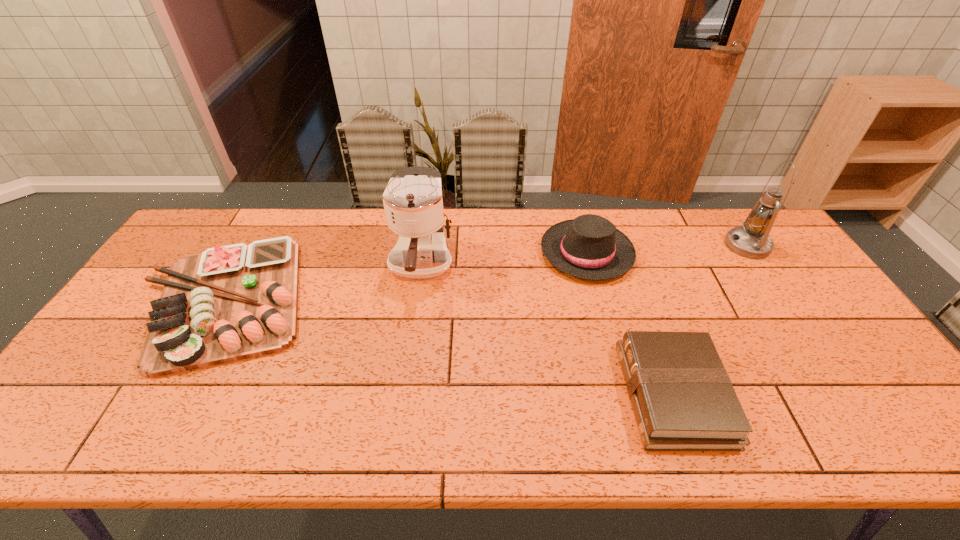
Image resolution: width=960 pixels, height=540 pixels. I want to click on object present at the far right corner, so click(751, 240).

The width and height of the screenshot is (960, 540). Identify the location of vacant region at the far edge of the desktop. (526, 252).

This screenshot has width=960, height=540. Identify the location of vacant space at the near edge of the desktop. (398, 427).

Find the location of a particular element. This screenshot has height=540, width=960. vacant space at the right edge of the desktop is located at coordinates (805, 281).

In the image, there is a desktop. At what (x,y) coordinates should I click in order to perform the action: click on vacant space at the far left corner. Please return your answer as a coordinate pair (x, y). The image size is (960, 540). Looking at the image, I should click on (204, 227).

In the image, there is a desktop. Where is `vacant space at the near right corner`? vacant space at the near right corner is located at coordinates (903, 445).

This screenshot has height=540, width=960. In order to click on vacant area between the Bible and the oil lamp in this screenshot , I will do `click(710, 320)`.

Where is `unoccupied area between the Bible and the platter`? Image resolution: width=960 pixels, height=540 pixels. unoccupied area between the Bible and the platter is located at coordinates (449, 347).

Locate an element on the screen. The width and height of the screenshot is (960, 540). vacant space in between the oil lamp and the dress hat is located at coordinates (667, 249).

Find the location of `free spot between the Bible and the platter`. free spot between the Bible and the platter is located at coordinates coord(449,347).